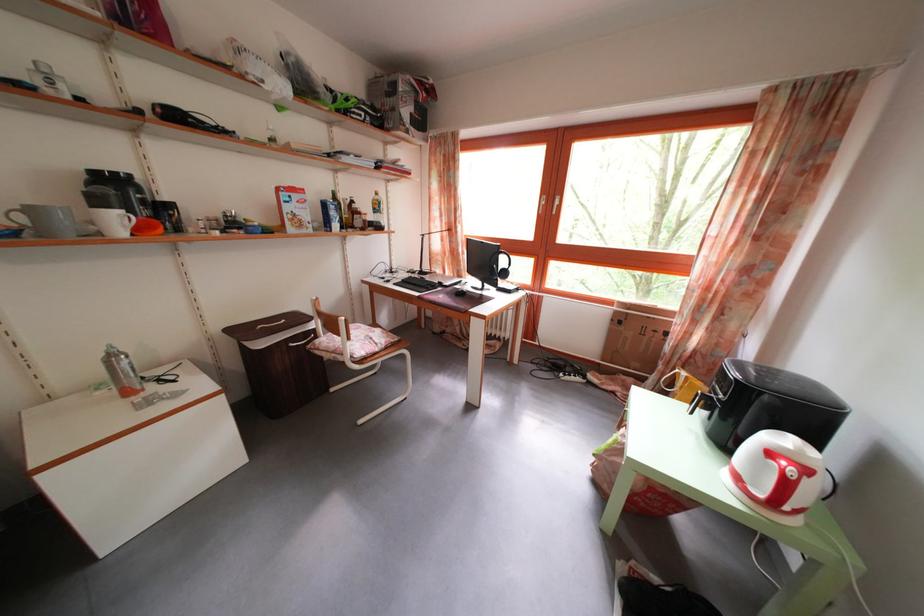
This screenshot has width=924, height=616. What do you see at coordinates (781, 469) in the screenshot? I see `a white kettle handle` at bounding box center [781, 469].